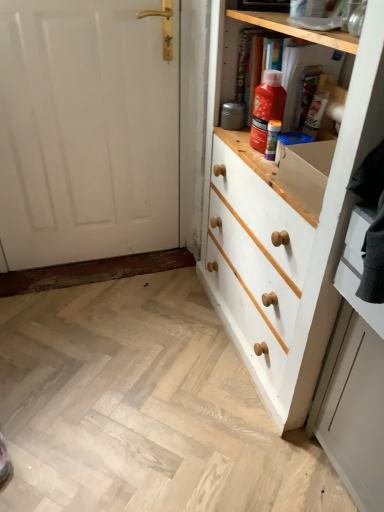
Question: From a real-world perspective, does white painted wood door at left stand above white painted wood drawer at right?

Choices:
 (A) no
 (B) yes

Answer: (A)

Question: Is there a large distance between white painted wood door at left and white painted wood drawer at right?

Choices:
 (A) no
 (B) yes

Answer: (B)

Question: From the image's perspective, is white painted wood door at left located above white painted wood drawer at right?

Choices:
 (A) yes
 (B) no

Answer: (A)

Question: Is white painted wood door at left positioned before white painted wood drawer at right?

Choices:
 (A) yes
 (B) no

Answer: (B)

Question: Is white painted wood door at left further to camera compared to white painted wood drawer at right?

Choices:
 (A) no
 (B) yes

Answer: (B)

Question: Considering the relative sizes of white painted wood door at left and white painted wood drawer at right in the image provided, is white painted wood door at left shorter than white painted wood drawer at right?

Choices:
 (A) no
 (B) yes

Answer: (A)

Question: From a real-world perspective, does white painted wood drawer at right sit lower than white painted wood chest of drawers at right?

Choices:
 (A) yes
 (B) no

Answer: (B)

Question: Is white painted wood chest of drawers at right at the back of white painted wood drawer at right?

Choices:
 (A) yes
 (B) no

Answer: (B)

Question: Does white painted wood drawer at right appear on the left side of white painted wood chest of drawers at right?

Choices:
 (A) no
 (B) yes

Answer: (A)

Question: Is white painted wood drawer at right smaller than white painted wood chest of drawers at right?

Choices:
 (A) yes
 (B) no

Answer: (A)

Question: Considering the relative sizes of white painted wood drawer at right and white painted wood chest of drawers at right in the image provided, is white painted wood drawer at right thinner than white painted wood chest of drawers at right?

Choices:
 (A) yes
 (B) no

Answer: (A)

Question: Would you say white painted wood drawer at right is outside white painted wood chest of drawers at right?

Choices:
 (A) no
 (B) yes

Answer: (B)

Question: From a real-world perspective, is white painted wood chest of drawers at right over white painted wood drawer at right?

Choices:
 (A) yes
 (B) no

Answer: (B)